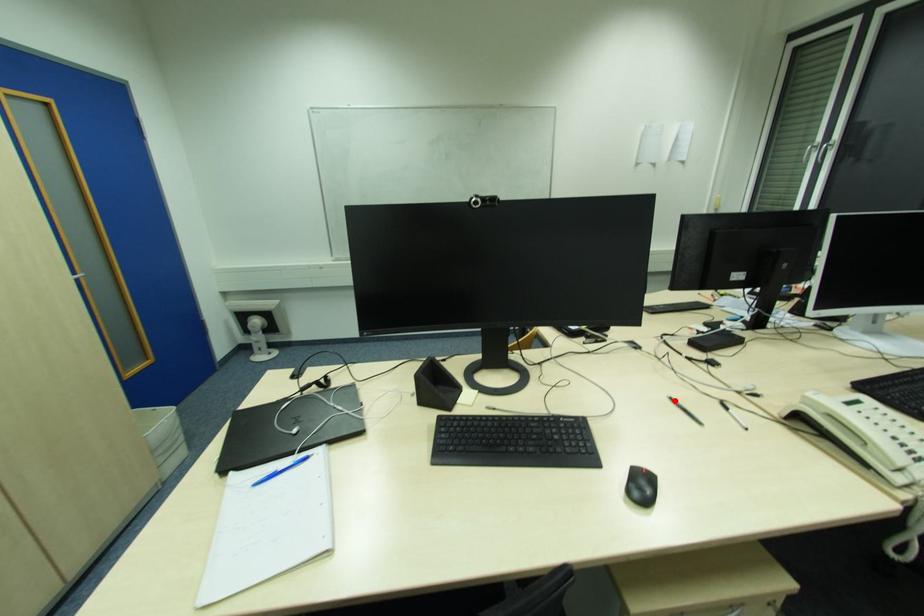
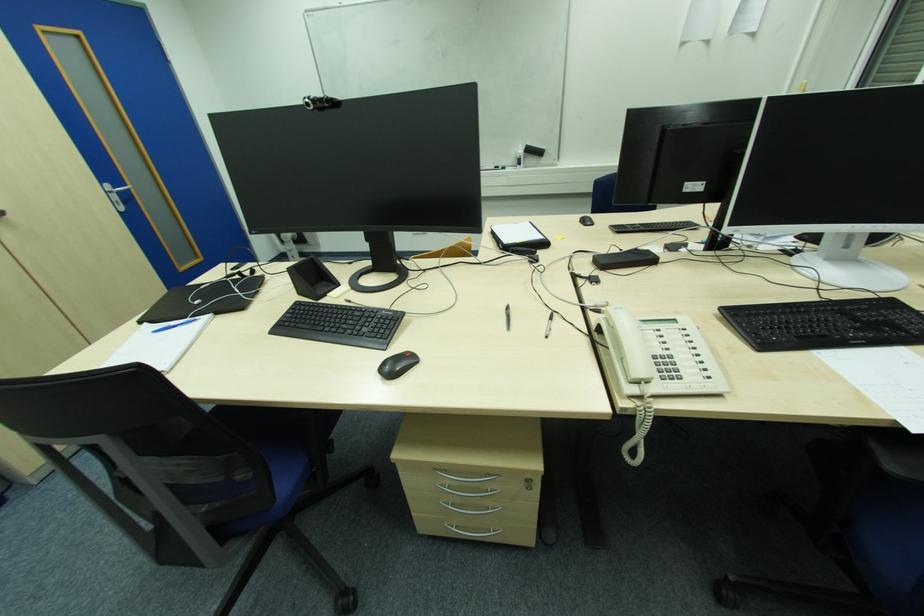
In the second image, find the point that corresponds to the highlighted location in the first image.

(509, 309)